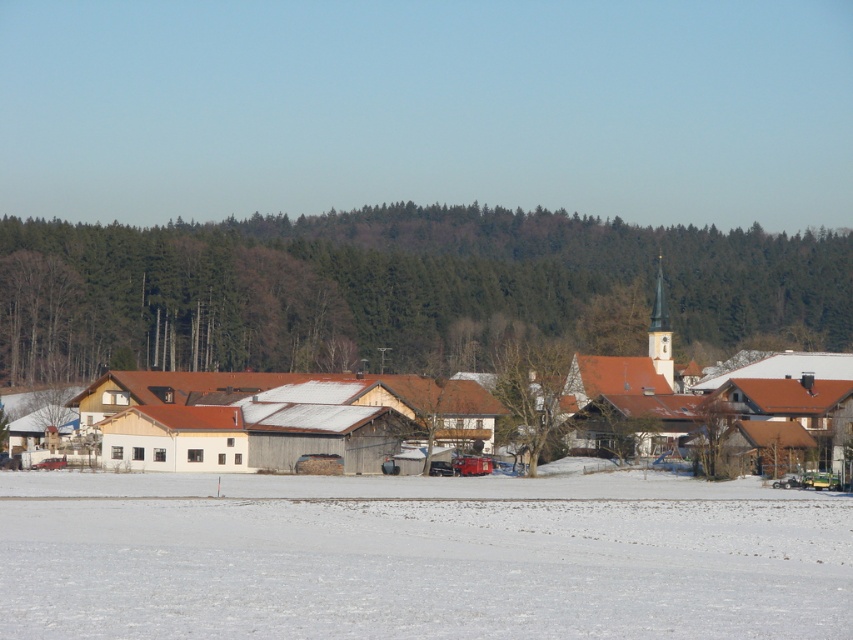
You are an artist trying to paint the winter scene. You want to place the brown wooden tree at center and the green leafy trees at center in your painting. Which one should you paint first to create the illusion of depth?

You should paint the green leafy trees at center first because the brown wooden tree at center is behind them, so you need to layer the brown wooden tree at center over the top to create depth.

You are standing in the snow covered field in the foreground of the winter landscape. You see a point marked at coordinates (401,291). What is located at that point?

The point at coordinates (401,291) marks green leafy trees at center.

You are an architect designing a new pathway that needs to pass between the white wooden houses at center and the brown wooden tree at center. Based on their positions in the image, which direction should the pathway be built to avoid obstacles?

The white wooden houses at center is located above the brown wooden tree at center, so the pathway should be built below the white wooden houses at center and above the brown wooden tree at center to avoid obstacles.